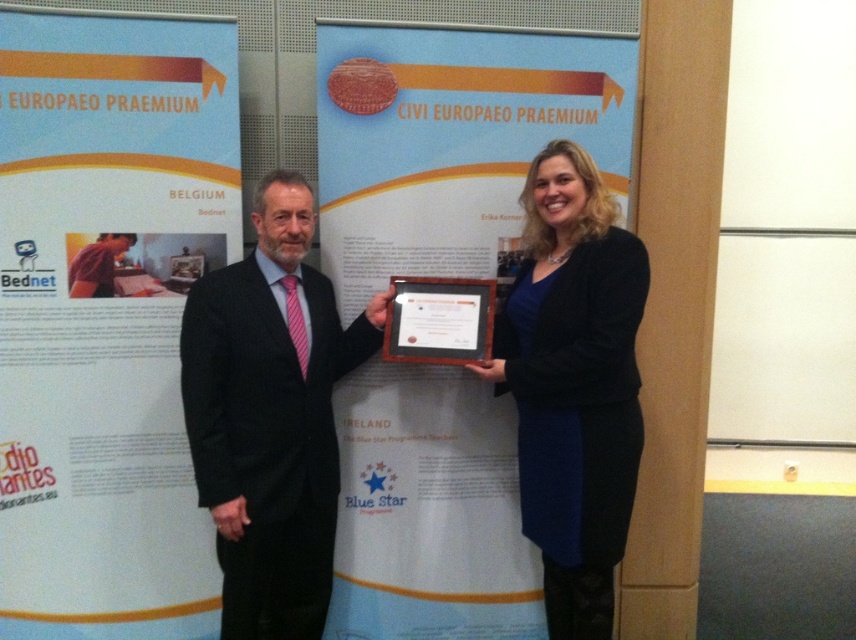
You are a photographer setting up for a group photo. You need to ensure that both the black suit at center and the black matte cardigan at center are fully visible in the frame. Which clothing item should you focus on adjusting the camera angle to accommodate its height?

The black matte cardigan at center is taller than the black suit at center, so you should focus on adjusting the camera angle to accommodate the height of the black matte cardigan at center to ensure both are fully visible.

What is the spatial relationship between the black matte cardigan at center and the other objects in the scene?

The black matte cardigan at center is positioned at coordinates point (574, 384), but since there are no other objects provided in the scene description besides the two people and banners, its exact spatial relationship cannot be determined relative to them.

You are organizing a photo shoot and need to decide which clothing item takes up more space in the frame. Based on the scene, which item is smaller in size between the black suit at center and the black matte cardigan at center?

The black suit at center occupies less space than the black matte cardigan at center, so the black suit at center is smaller in size.